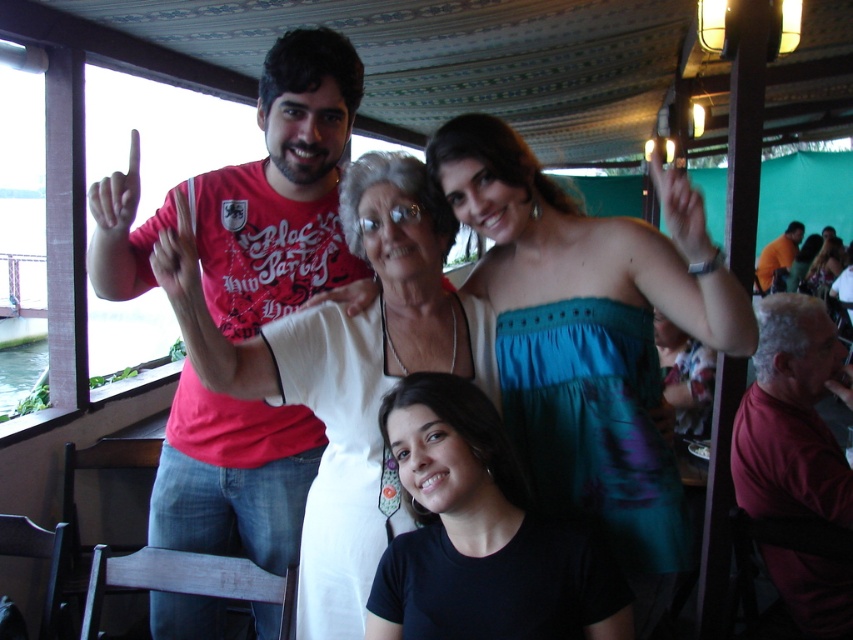
You are a photographer standing 1.5 meters away from the white fabric at center. You want to take a photo of the dark red shirt at right without moving your position. Can you do it?

The white fabric at center is 1.24 meters away from the dark red shirt at right, so you can take a photo of the dark red shirt at right without moving your position since the distance between them is less than your current distance from the white fabric.